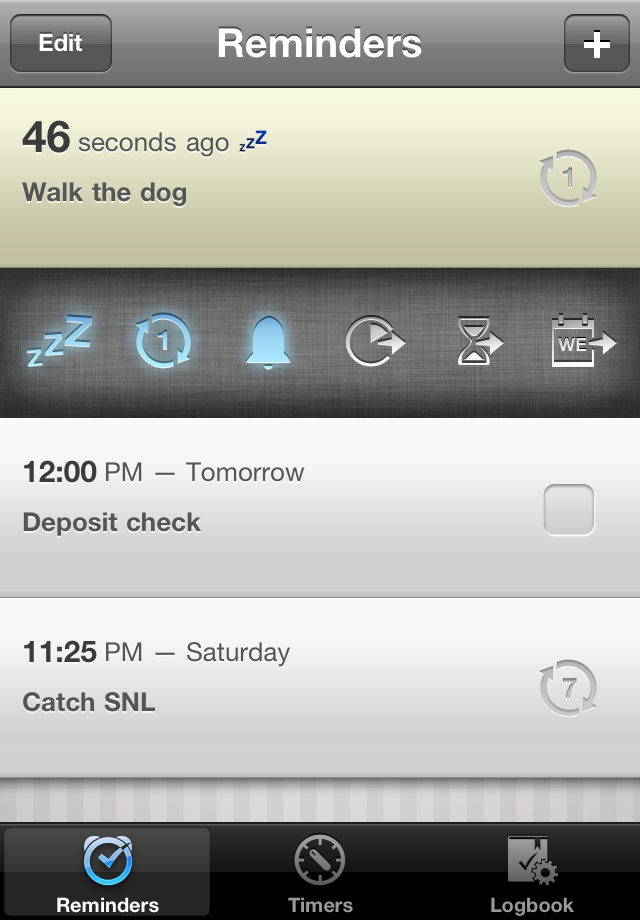
Where is `snooze button`? The width and height of the screenshot is (640, 920). snooze button is located at coordinates (54, 339).